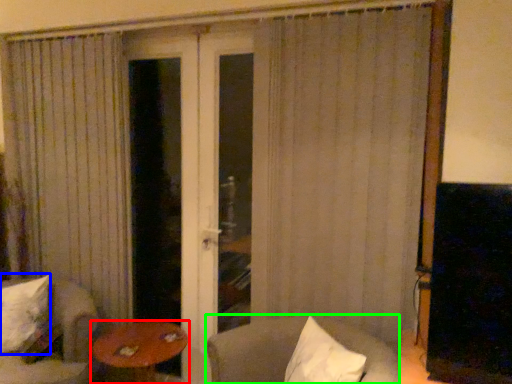
Question: Based on their relative distances, which object is nearer to table (highlighted by a red box)? Choose from pillow (highlighted by a blue box) and chair (highlighted by a green box).

Choices:
 (A) pillow
 (B) chair

Answer: (A)